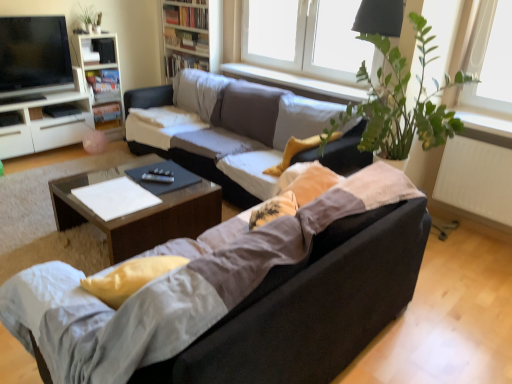
The width and height of the screenshot is (512, 384). Identify the location of vacant area on top of matte black coffee table at center (from a real-world perspective). (123, 184).